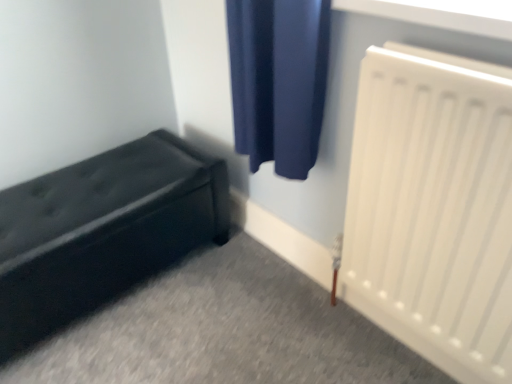
Question: Is white plastic radiator at right located outside black leather bench at lower left?

Choices:
 (A) yes
 (B) no

Answer: (A)

Question: Considering the relative sizes of white plastic radiator at right and black leather bench at lower left in the image provided, is white plastic radiator at right smaller than black leather bench at lower left?

Choices:
 (A) yes
 (B) no

Answer: (A)

Question: Is white plastic radiator at right positioned before black leather bench at lower left?

Choices:
 (A) no
 (B) yes

Answer: (B)

Question: From the image's perspective, would you say white plastic radiator at right is shown under black leather bench at lower left?

Choices:
 (A) no
 (B) yes

Answer: (A)

Question: Is black leather bench at lower left a part of white plastic radiator at right?

Choices:
 (A) yes
 (B) no

Answer: (B)

Question: Can you confirm if white plastic radiator at right is taller than black leather bench at lower left?

Choices:
 (A) no
 (B) yes

Answer: (B)

Question: Is black leather bench at lower left thinner than white plastic radiator at right?

Choices:
 (A) yes
 (B) no

Answer: (B)

Question: Considering the relative positions of black leather bench at lower left and white plastic radiator at right in the image provided, is black leather bench at lower left in front of white plastic radiator at right?

Choices:
 (A) yes
 (B) no

Answer: (B)

Question: Does black leather bench at lower left have a smaller size compared to white plastic radiator at right?

Choices:
 (A) yes
 (B) no

Answer: (B)

Question: Would you say black leather bench at lower left is a long distance from white plastic radiator at right?

Choices:
 (A) no
 (B) yes

Answer: (A)

Question: Considering the relative sizes of black leather bench at lower left and white plastic radiator at right in the image provided, is black leather bench at lower left taller than white plastic radiator at right?

Choices:
 (A) yes
 (B) no

Answer: (B)

Question: Is black leather bench at lower left outside of white plastic radiator at right?

Choices:
 (A) yes
 (B) no

Answer: (A)

Question: Is black leather bench at lower left spatially inside white plastic radiator at right, or outside of it?

Choices:
 (A) outside
 (B) inside

Answer: (A)